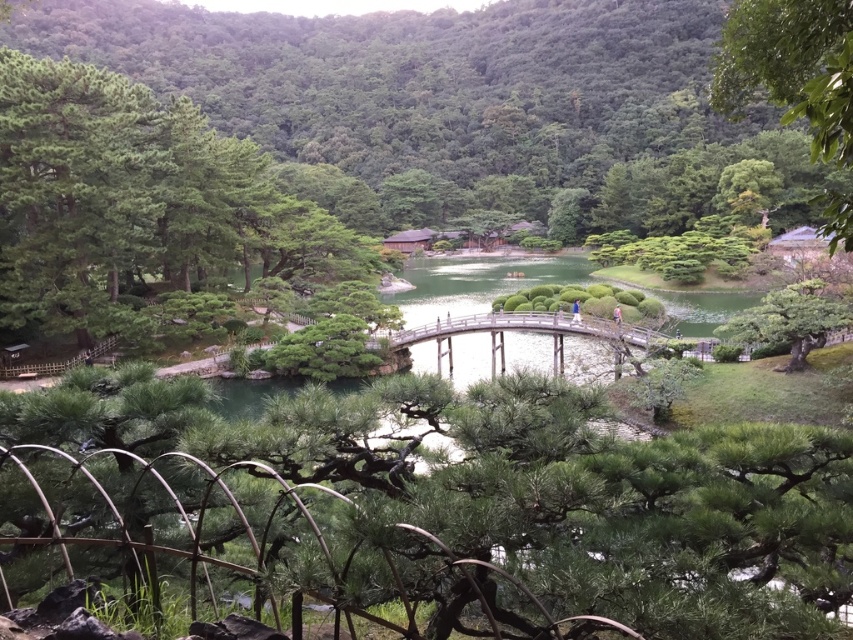
Question: Among these points, which one is farthest from the camera?

Choices:
 (A) (825, 140)
 (B) (1, 81)

Answer: (B)

Question: Can you confirm if green textured pine tree at left is bigger than wooden bridge at center?

Choices:
 (A) yes
 (B) no

Answer: (A)

Question: Which point is farther to the camera?

Choices:
 (A) wooden bridge at center
 (B) green textured pine tree at left

Answer: (B)

Question: Is green textured pine tree at left above green leafy tree at upper right?

Choices:
 (A) no
 (B) yes

Answer: (B)

Question: Is green leafy tree at upper right closer to camera compared to wooden bridge at center?

Choices:
 (A) no
 (B) yes

Answer: (B)

Question: Which point is closer to the camera?

Choices:
 (A) green leafy tree at upper right
 (B) wooden bridge at center

Answer: (A)